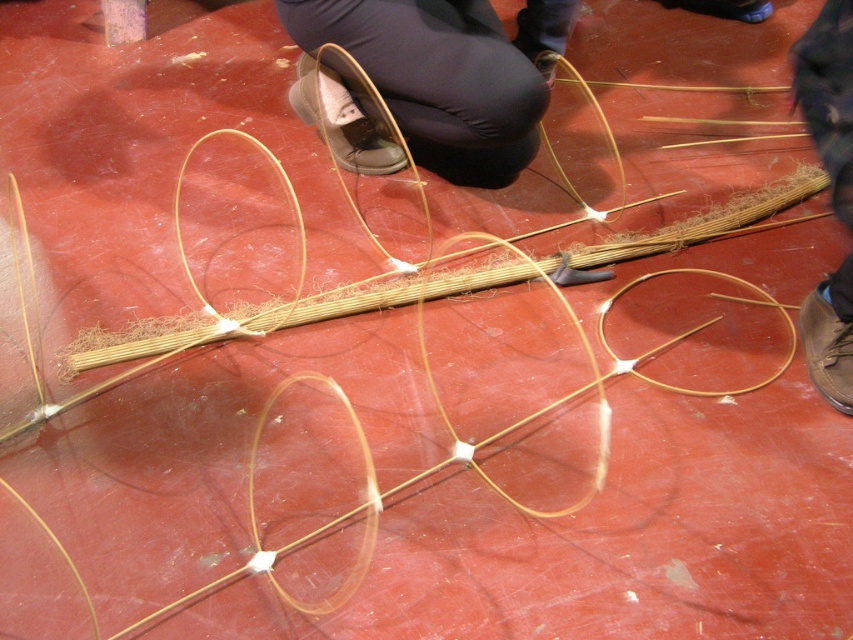
You are a delivery robot in a room with two brown leather shoes. You need to place a package between them. The package is 28 inches long. Will the distance between the brown leather shoe at center and the brown leather shoe at lower right be enough to fit the package?

The distance between the brown leather shoe at center and the brown leather shoe at lower right is 27.98 inches. Since the package is 28 inches long, it will not fit between them as the distance is slightly shorter than the package length.

Consider the image. You are standing in the scene and want to place a small object exactly at the coordinates given for the brown leather shoe at center. What are the coordinates where you should place it?

The coordinates for the brown leather shoe at center are 0.116 on the x axis and 0.525 on the y axis, so you should place the object at those coordinates.

You are standing 6 feet away from the camera. Can you reach the brown leather shoe at center without moving your feet?

The brown leather shoe at center is 5.67 feet away from the camera. Since you are standing 6 feet away from the camera, you are slightly farther than the shoe. Depending on your arm length, you might be able to reach it, but it would require stretching. However, without precise arm length data, it is uncertain.